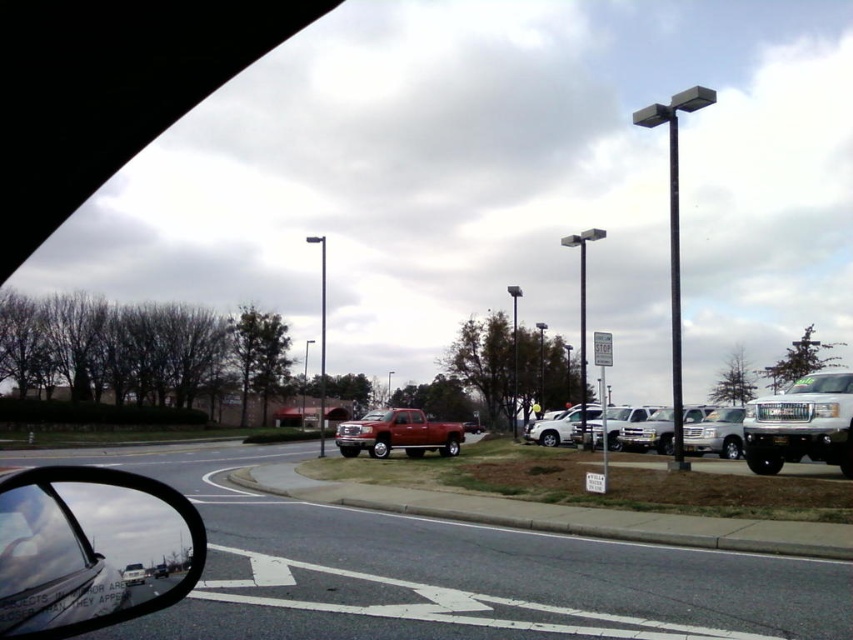
Question: Among these objects, which one is nearest to the camera?

Choices:
 (A) silver metallic suv at right
 (B) white glossy truck at right

Answer: (B)

Question: Does white glossy truck at right come behind silver metallic suv at right?

Choices:
 (A) no
 (B) yes

Answer: (A)

Question: Is silver metallic suv at right wider than satin silver suv at center?

Choices:
 (A) yes
 (B) no

Answer: (B)

Question: Estimate the real-world distances between objects in this image. Which object is farther from the silver metallic suv at right?

Choices:
 (A) satin silver suv at center
 (B) shiny red truck at center
 (C) white glossy truck at right

Answer: (B)

Question: Which of these objects is positioned closest to the silver metallic suv at right?

Choices:
 (A) satin silver suv at center
 (B) white glossy truck at right

Answer: (B)

Question: Can you confirm if shiny red truck at center is positioned below satin silver suv at center?

Choices:
 (A) no
 (B) yes

Answer: (B)